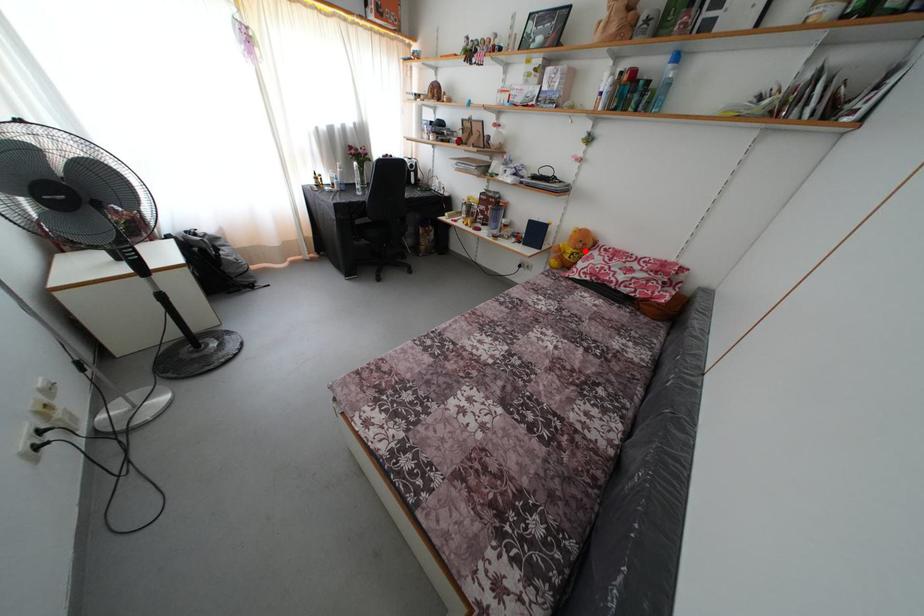
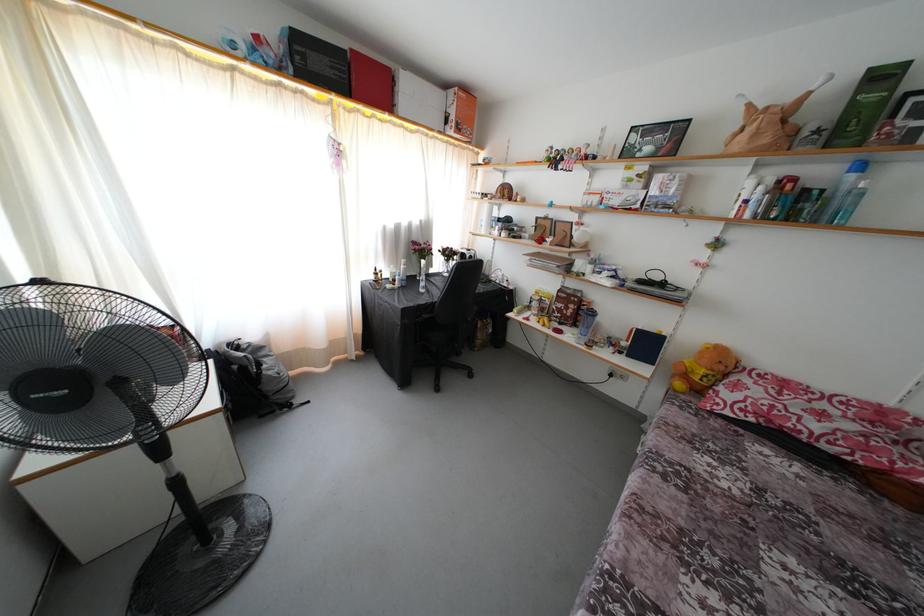
Find the pixel in the second image that matches the highlighted location in the first image.

(726, 373)